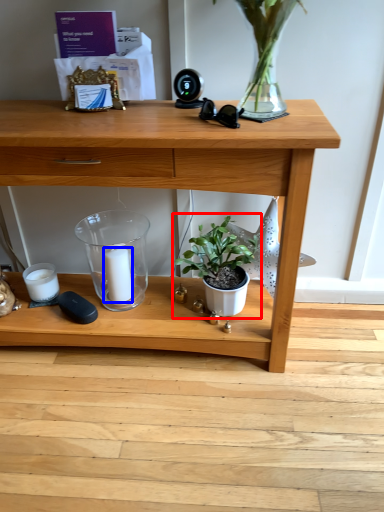
Question: Which object appears farthest to the camera in this image, houseplant (highlighted by a red box) or candle (highlighted by a blue box)?

Choices:
 (A) houseplant
 (B) candle

Answer: (B)